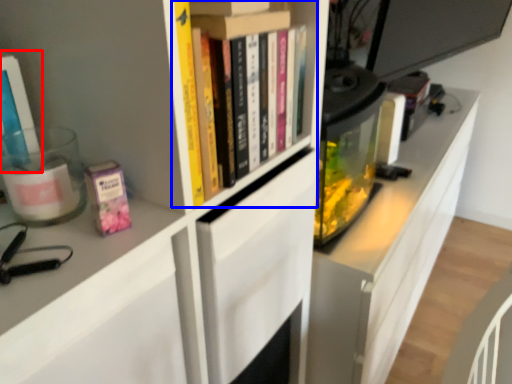
Question: Among these objects, which one is farthest to the camera, book (highlighted by a red box) or book (highlighted by a blue box)?

Choices:
 (A) book
 (B) book

Answer: (B)